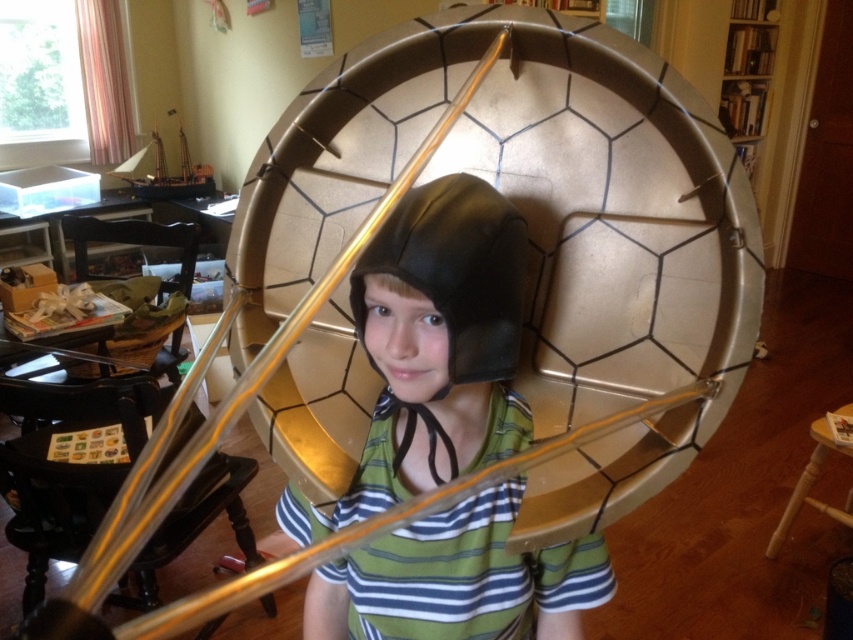
Is matte black helmet at center shorter than black leather helmet at center?

No, matte black helmet at center is not shorter than black leather helmet at center.

Does matte black helmet at center have a lesser width compared to black leather helmet at center?

In fact, matte black helmet at center might be wider than black leather helmet at center.

This screenshot has height=640, width=853. Find the location of `matte black helmet at center`. matte black helmet at center is located at coordinates (433, 348).